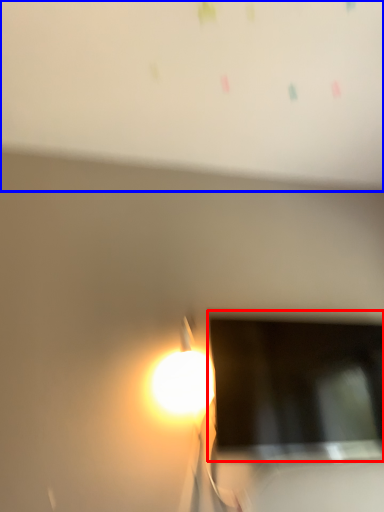
Question: Which object is further to the camera taking this photo, computer screen (highlighted by a red box) or bulletin board (highlighted by a blue box)?

Choices:
 (A) computer screen
 (B) bulletin board

Answer: (A)